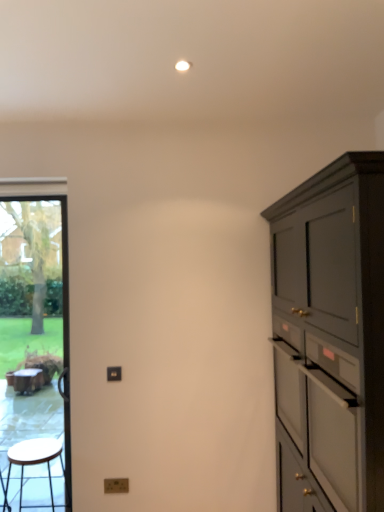
Question: Considering the relative positions of white matte drawer at right and transparent glass door at left in the image provided, is white matte drawer at right to the right of transparent glass door at left from the viewer's perspective?

Choices:
 (A) yes
 (B) no

Answer: (A)

Question: Can we say white matte drawer at right lies outside transparent glass door at left?

Choices:
 (A) no
 (B) yes

Answer: (B)

Question: Is transparent glass door at left inside white matte drawer at right?

Choices:
 (A) yes
 (B) no

Answer: (B)

Question: Is white matte drawer at right in front of transparent glass door at left?

Choices:
 (A) yes
 (B) no

Answer: (A)

Question: Considering the relative sizes of white matte drawer at right and transparent glass door at left in the image provided, is white matte drawer at right taller than transparent glass door at left?

Choices:
 (A) yes
 (B) no

Answer: (B)

Question: In the image, is matte dark gray cabinet at right positioned in front of or behind white matte drawer at right?

Choices:
 (A) front
 (B) behind

Answer: (A)

Question: From the image's perspective, is matte dark gray cabinet at right positioned above or below white matte drawer at right?

Choices:
 (A) above
 (B) below

Answer: (B)

Question: Is point (301, 215) positioned closer to the camera than point (283, 471)?

Choices:
 (A) farther
 (B) closer

Answer: (B)

Question: Is matte dark gray cabinet at right wider or thinner than white matte drawer at right?

Choices:
 (A) wide
 (B) thin

Answer: (A)

Question: Relative to wooden stool at left, is transparent glass door at left in front or behind?

Choices:
 (A) front
 (B) behind

Answer: (B)

Question: Based on their sizes in the image, would you say transparent glass door at left is bigger or smaller than wooden stool at left?

Choices:
 (A) big
 (B) small

Answer: (A)

Question: Considering the relative positions of transparent glass door at left and wooden stool at left in the image provided, is transparent glass door at left to the left or to the right of wooden stool at left?

Choices:
 (A) left
 (B) right

Answer: (A)

Question: Looking at their shapes, would you say transparent glass door at left is wider or thinner than wooden stool at left?

Choices:
 (A) thin
 (B) wide

Answer: (A)

Question: From a real-world perspective, relative to wooden stool at left, is white matte drawer at right vertically above or below?

Choices:
 (A) above
 (B) below

Answer: (A)

Question: Considering the positions of point (359, 420) and point (39, 456), is point (359, 420) closer or farther from the camera than point (39, 456)?

Choices:
 (A) closer
 (B) farther

Answer: (A)